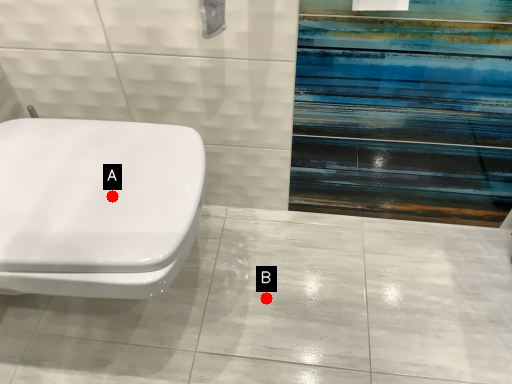
Question: Two points are circled on the image, labeled by A and B beside each circle. Which point appears farthest from the camera in this image?

Choices:
 (A) A is further
 (B) B is further

Answer: (B)